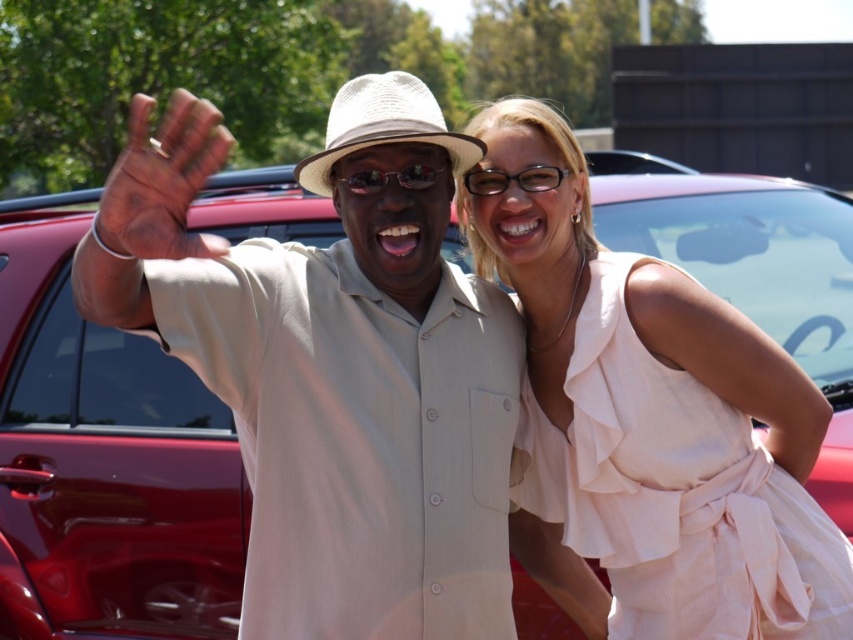
Question: Which of the following is the farthest from the observer?

Choices:
 (A) (553, 170)
 (B) (596, 316)
 (C) (395, 241)

Answer: (A)

Question: Which object appears farthest from the camera in this image?

Choices:
 (A) sunglasses at center
 (B) transparent plastic glasses at upper center

Answer: (B)

Question: Considering the real-world distances, which object is closest to the beige matte hat at center?

Choices:
 (A) dark skin hand at center
 (B) sunglasses at center
 (C) transparent plastic glasses at upper center
 (D) metallic red car at center

Answer: (B)

Question: Is dark skin hand at center wider than transparent plastic glasses at upper center?

Choices:
 (A) no
 (B) yes

Answer: (B)

Question: Can you confirm if dark skin hand at center is positioned to the left of sunglasses at center?

Choices:
 (A) yes
 (B) no

Answer: (A)

Question: Is beige matte hat at center above metallic red car at center?

Choices:
 (A) yes
 (B) no

Answer: (A)